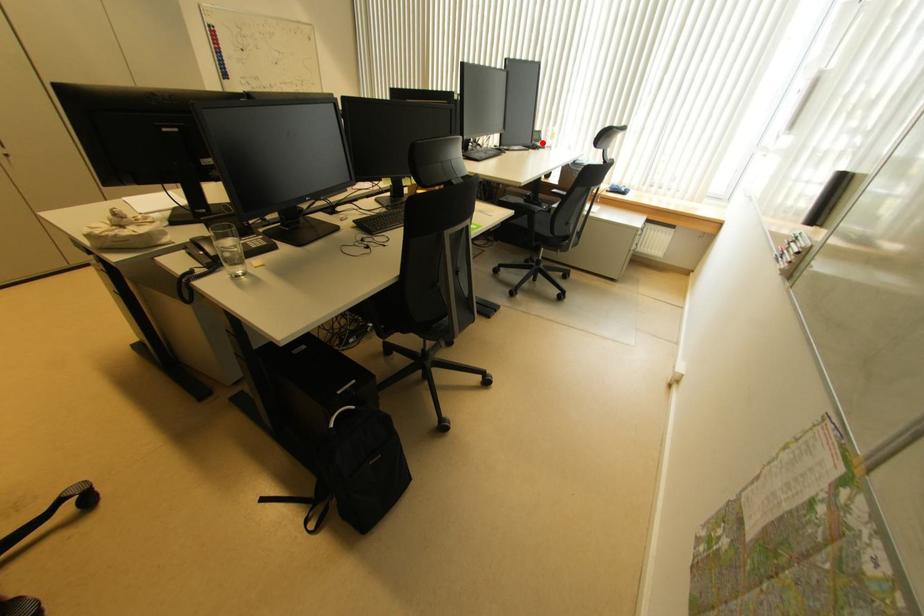
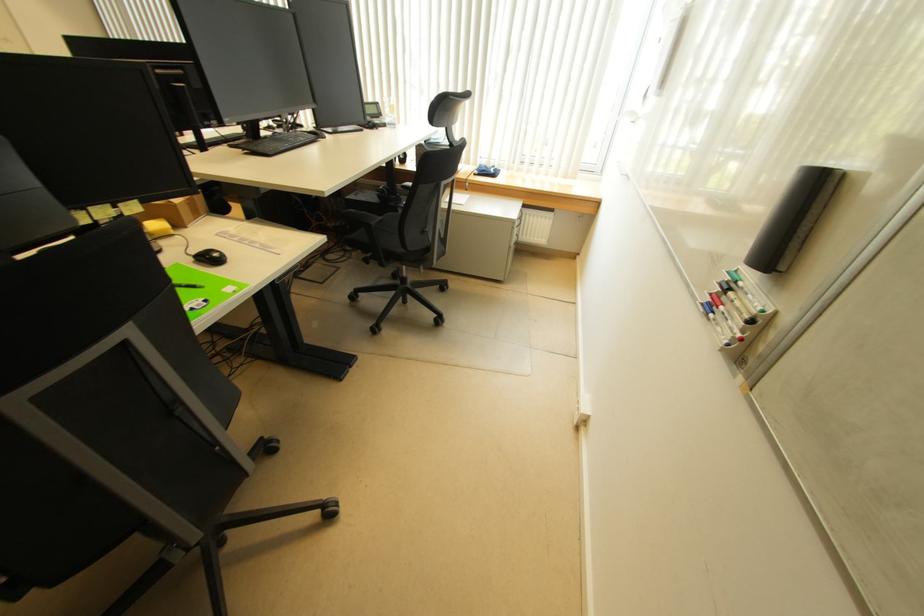
The point at the highlighted location is marked in the first image. Where is the corresponding point in the second image?

(382, 118)